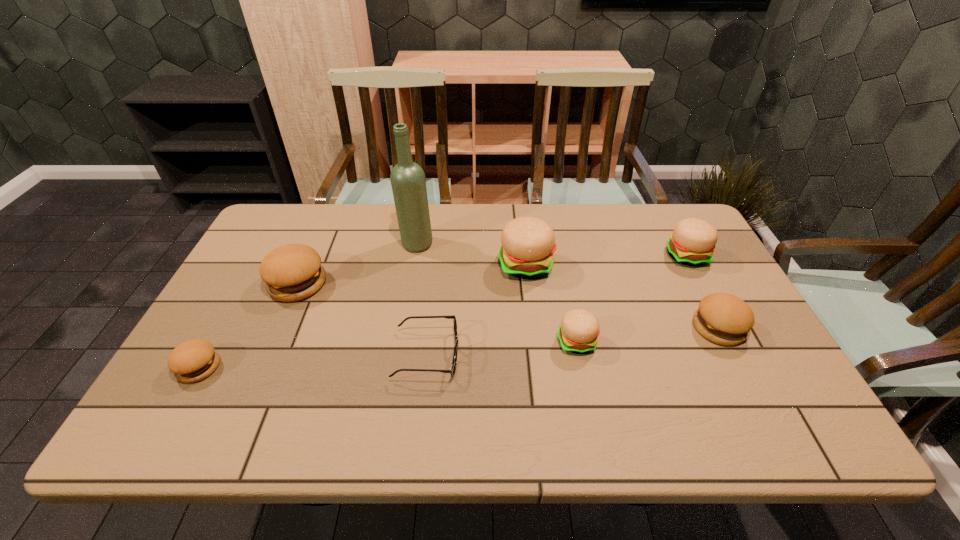
Identify the location of free spot located 0.350m on the front-facing side of the spectacles. The height and width of the screenshot is (540, 960). (603, 355).

This screenshot has width=960, height=540. In order to click on wine bottle located at the far edge in this screenshot , I will do `click(407, 178)`.

Identify the location of hamburger that is at the far edge. (693, 241).

Locate an element on the screen. The height and width of the screenshot is (540, 960). object that is at the far right corner is located at coordinates [x=693, y=241].

Identify the location of free region at the far edge of the desktop. The height and width of the screenshot is (540, 960). (445, 222).

This screenshot has height=540, width=960. In order to click on free space at the near edge in this screenshot , I will do `click(604, 406)`.

Image resolution: width=960 pixels, height=540 pixels. What are the coordinates of `free space at the right edge of the desktop` in the screenshot? It's located at (716, 268).

This screenshot has height=540, width=960. In the image, there is a desktop. In order to click on free space at the far left corner in this screenshot , I will do `click(291, 232)`.

Identify the location of vacant space at the far right corner of the desktop. (673, 203).

Identify the location of unoccupied position between the second biggest brown hamburger and the nearest beige hamburger. (647, 335).